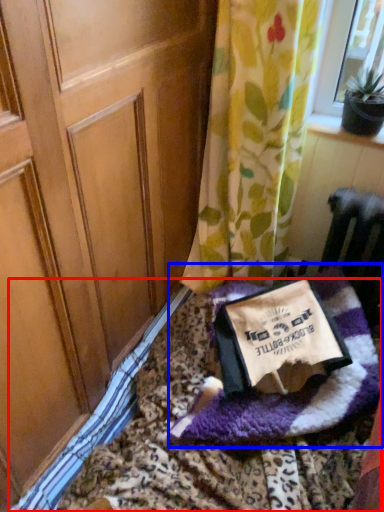
Question: Which object appears farthest to the camera in this image, bedding (highlighted by a red box) or blanket (highlighted by a blue box)?

Choices:
 (A) bedding
 (B) blanket

Answer: (B)